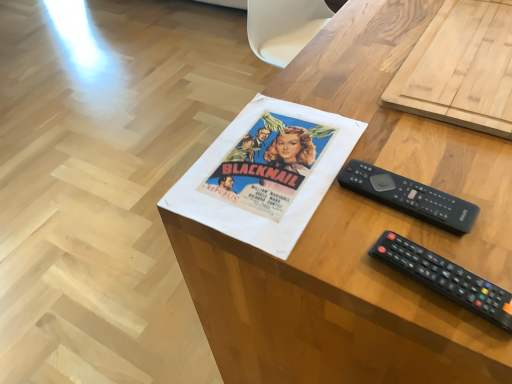
Question: Does woodendesk at center come in front of black plastic remote at lower right, which is the second remote control in top-to-bottom order?

Choices:
 (A) yes
 (B) no

Answer: (A)

Question: Is woodendesk at center shorter than black plastic remote at lower right, the first remote control positioned from the front?

Choices:
 (A) no
 (B) yes

Answer: (A)

Question: Does woodendesk at center contain black plastic remote at lower right, the second remote control in the back-to-front sequence?

Choices:
 (A) no
 (B) yes

Answer: (B)

Question: Is woodendesk at center next to black plastic remote at lower right, the second remote control in the back-to-front sequence?

Choices:
 (A) yes
 (B) no

Answer: (B)

Question: Does woodendesk at center turn towards black plastic remote at lower right, positioned as the first remote control in bottom-to-top order?

Choices:
 (A) yes
 (B) no

Answer: (B)

Question: Is woodendesk at center far away from black plastic remote at lower right, the second remote control in the back-to-front sequence?

Choices:
 (A) yes
 (B) no

Answer: (B)

Question: Does black plastic remote at lower right, positioned as the first remote control in bottom-to-top order, have a lesser height compared to woodendesk at center?

Choices:
 (A) yes
 (B) no

Answer: (A)

Question: Would you consider black plastic remote at lower right, the first remote control positioned from the front, to be distant from woodendesk at center?

Choices:
 (A) yes
 (B) no

Answer: (B)

Question: Is black plastic remote at lower right, which is the second remote control in top-to-bottom order, at the right side of woodendesk at center?

Choices:
 (A) no
 (B) yes

Answer: (A)

Question: Is the depth of black plastic remote at lower right, the first remote control positioned from the front, less than that of woodendesk at center?

Choices:
 (A) no
 (B) yes

Answer: (A)

Question: From a real-world perspective, is black plastic remote at lower right, the second remote control in the back-to-front sequence, located higher than woodendesk at center?

Choices:
 (A) no
 (B) yes

Answer: (B)

Question: Considering the relative positions of black plastic remote at lower right, positioned as the first remote control in bottom-to-top order, and woodendesk at center in the image provided, is black plastic remote at lower right, positioned as the first remote control in bottom-to-top order, behind woodendesk at center?

Choices:
 (A) yes
 (B) no

Answer: (A)

Question: From a real-world perspective, is black plastic remote at center right, the second remote control in the front-to-back sequence, over black plastic remote at lower right, the first remote control positioned from the front?

Choices:
 (A) yes
 (B) no

Answer: (B)